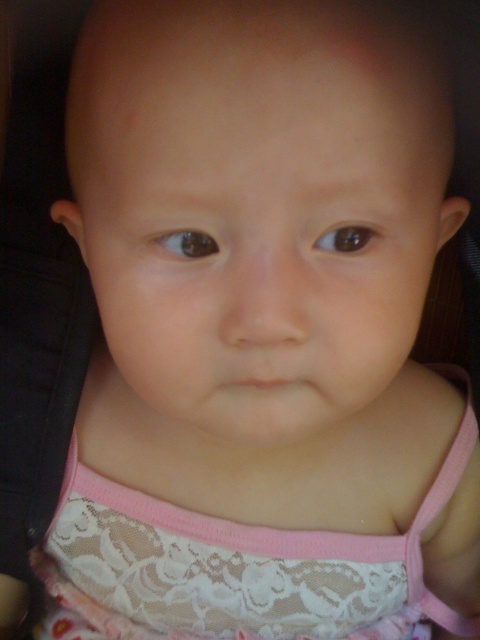
You are a photographer adjusting lighting for a baby photo shoot. You notice the lace fabric dress at center and the pink fabric strap at center in the image. Which item should you focus your lighting on to highlight its size difference?

The lace fabric dress at center is larger in size than the pink fabric strap at center, so you should focus the lighting on the lace fabric dress at center to emphasize its larger size compared to the pink fabric strap at center.

You are a photographer adjusting the lighting for a baby photo shoot. The baby is wearing a lace fabric dress at center. There is a point at coordinates point (x=235, y=566). Where is this point located in relation to the lace fabric dress at center?

The point (x=235, y=566) is located on the lace fabric dress at center.

You are a photographer adjusting the focus on a camera. You need to focus on the two points in the image, point 1 at point (x=402, y=556) and point 2 at point (x=439, y=620). Which point should you focus on first if you want to follow the natural viewing path from front to back?

Point 1 at point (x=402, y=556) should be focused on first because it is in front of point 2 at point (x=439, y=620) according to the spatial arrangement.